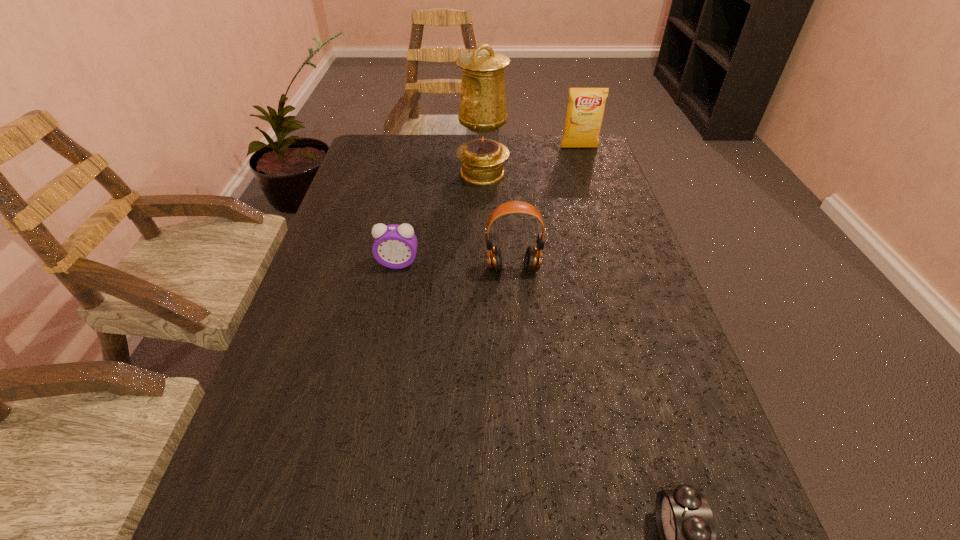
The height and width of the screenshot is (540, 960). I want to click on the fourth nearest object, so click(482, 111).

Identify the location of the tallest object. Image resolution: width=960 pixels, height=540 pixels. (482, 111).

At what (x,y) coordinates should I click in order to perform the action: click on crisp (potato chip). Please return your answer as a coordinate pair (x, y). Image resolution: width=960 pixels, height=540 pixels. Looking at the image, I should click on (585, 110).

Where is `headset`? The image size is (960, 540). headset is located at coordinates (533, 257).

Image resolution: width=960 pixels, height=540 pixels. Find the location of `the left alarm clock`. the left alarm clock is located at coordinates (395, 246).

I want to click on the leftmost object, so click(395, 246).

Locate an element on the screen. vacant space located on the left of the tallest object is located at coordinates (426, 173).

Where is `vacant space situated 0.290m on the front of the farthest object with the logo`? The image size is (960, 540). vacant space situated 0.290m on the front of the farthest object with the logo is located at coordinates (598, 204).

Find the location of `free region located on the ear cups of the headset`. free region located on the ear cups of the headset is located at coordinates (520, 364).

You are a GUI agent. You are given a task and a screenshot of the screen. Output one action in this format:
    pyautogui.click(x=<x>, y=<y>)
    Task: Click on the free space located on the face of the left alarm clock
    The width and height of the screenshot is (960, 540).
    Given the screenshot: What is the action you would take?
    pyautogui.click(x=376, y=370)